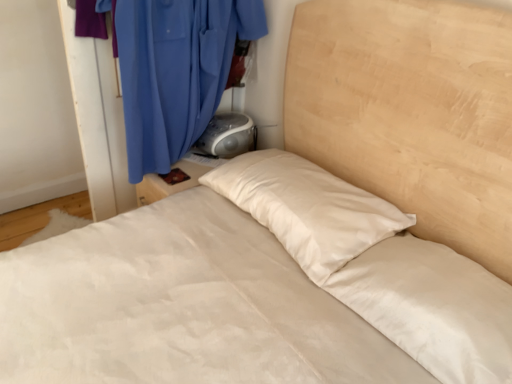
Question: From the image's perspective, is blue fabric curtain at upper left located beneath gray plastic radio at upper right?

Choices:
 (A) yes
 (B) no

Answer: (B)

Question: Is gray plastic radio at upper right a part of blue fabric curtain at upper left?

Choices:
 (A) yes
 (B) no

Answer: (A)

Question: Does blue fabric curtain at upper left have a smaller size compared to gray plastic radio at upper right?

Choices:
 (A) yes
 (B) no

Answer: (B)

Question: Is blue fabric curtain at upper left touching gray plastic radio at upper right?

Choices:
 (A) yes
 (B) no

Answer: (B)

Question: Does blue fabric curtain at upper left appear on the left side of gray plastic radio at upper right?

Choices:
 (A) yes
 (B) no

Answer: (A)

Question: Is blue fabric curtain at upper left far away from gray plastic radio at upper right?

Choices:
 (A) yes
 (B) no

Answer: (B)

Question: From a real-world perspective, is gray plastic radio at upper right located beneath blue fabric curtain at upper left?

Choices:
 (A) yes
 (B) no

Answer: (A)

Question: Is gray plastic radio at upper right completely or partially outside of blue fabric curtain at upper left?

Choices:
 (A) yes
 (B) no

Answer: (B)

Question: From a real-world perspective, is gray plastic radio at upper right on blue fabric curtain at upper left?

Choices:
 (A) no
 (B) yes

Answer: (A)

Question: Does gray plastic radio at upper right appear on the right side of blue fabric curtain at upper left?

Choices:
 (A) no
 (B) yes

Answer: (B)

Question: Can you see gray plastic radio at upper right touching blue fabric curtain at upper left?

Choices:
 (A) yes
 (B) no

Answer: (B)

Question: From the image's perspective, does gray plastic radio at upper right appear higher than blue fabric curtain at upper left?

Choices:
 (A) no
 (B) yes

Answer: (A)

Question: From a real-world perspective, is gray plastic radio at upper right positioned above or below blue fabric curtain at upper left?

Choices:
 (A) below
 (B) above

Answer: (A)